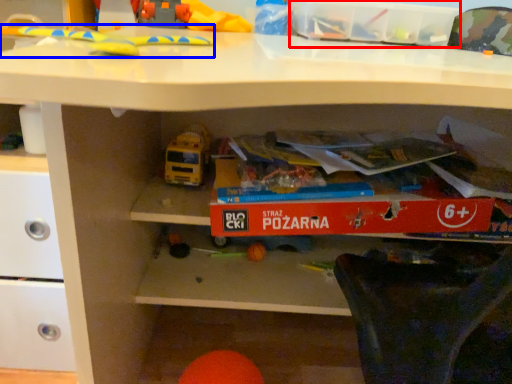
Question: Which object appears farthest to the camera in this image, storage box (highlighted by a red box) or toy (highlighted by a blue box)?

Choices:
 (A) storage box
 (B) toy

Answer: (A)